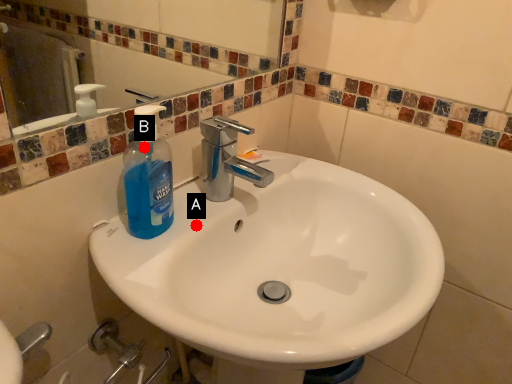
Question: Two points are circled on the image, labeled by A and B beside each circle. Which point is closer to the camera?

Choices:
 (A) A is closer
 (B) B is closer

Answer: (B)